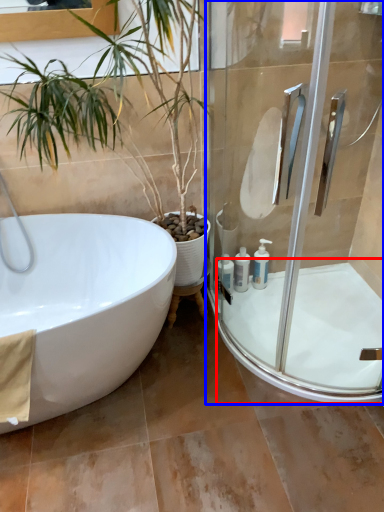
Question: Which object appears farthest to the camera in this image, bath (highlighted by a red box) or shower door (highlighted by a blue box)?

Choices:
 (A) bath
 (B) shower door

Answer: (A)